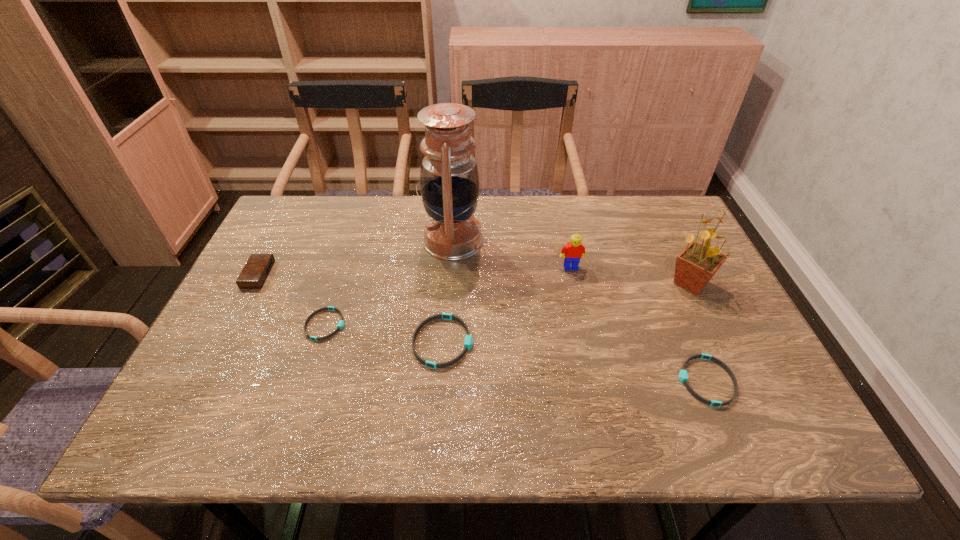
This screenshot has height=540, width=960. I want to click on vacant region at the left edge, so click(x=238, y=339).

The width and height of the screenshot is (960, 540). In order to click on blank area at the right edge in this screenshot , I will do (x=674, y=249).

The height and width of the screenshot is (540, 960). What are the coordinates of `vacant space at the far left corner` in the screenshot? It's located at (320, 222).

The width and height of the screenshot is (960, 540). In order to click on free spot between the tallest object and the third object from right to left in this screenshot , I will do `click(512, 254)`.

This screenshot has width=960, height=540. In order to click on vacant space in between the oil lamp and the third shortest object in this screenshot , I will do `click(448, 292)`.

Find the location of a particular element. The height and width of the screenshot is (540, 960). vacant region between the alarm clock and the second shortest object is located at coordinates (482, 328).

Locate an element on the screen. vacant area that lies between the second shortest object and the third object from right to left is located at coordinates (638, 324).

Find the location of a particular element. The image size is (960, 540). vacant space that is in between the Lego and the alarm clock is located at coordinates (415, 271).

Image resolution: width=960 pixels, height=540 pixels. I want to click on vacant area that lies between the shortest wristband and the oil lamp, so click(x=389, y=283).

Image resolution: width=960 pixels, height=540 pixels. What are the coordinates of `free space between the leftmost object and the fifth tallest object` in the screenshot? It's located at (350, 308).